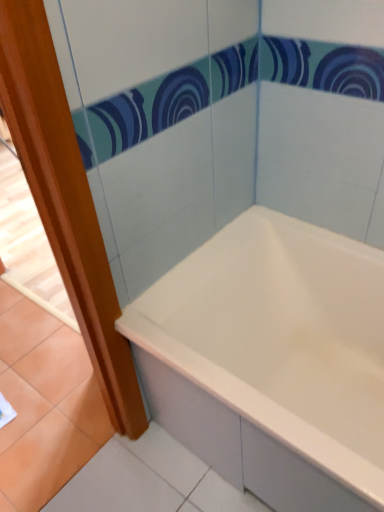
Question: Should I look upward or downward to see white glossy bathtub at center?

Choices:
 (A) up
 (B) down

Answer: (B)